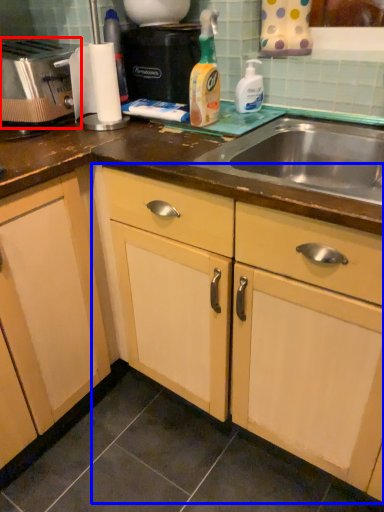
Question: Which object is closer to the camera taking this photo, toaster (highlighted by a red box) or cabinetry (highlighted by a blue box)?

Choices:
 (A) toaster
 (B) cabinetry

Answer: (B)